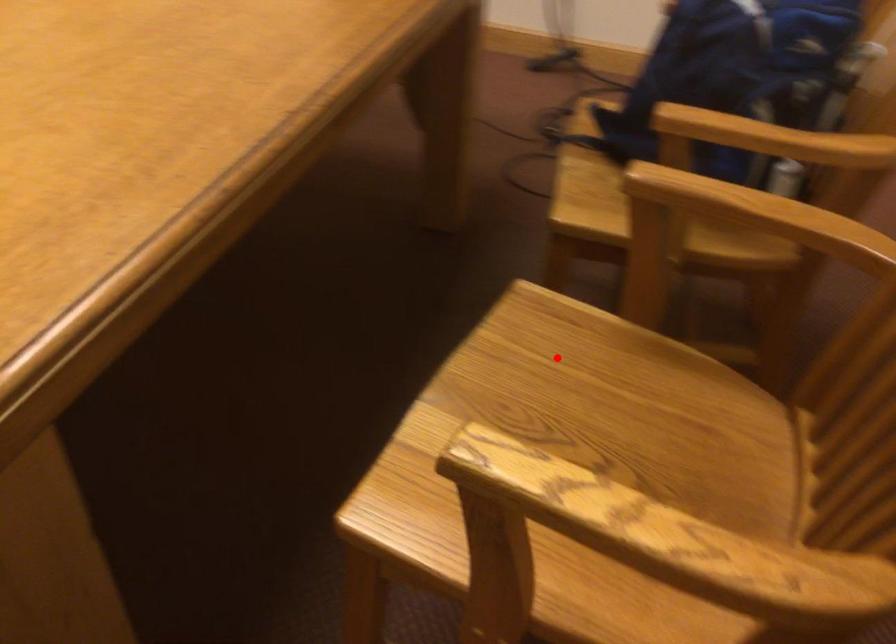
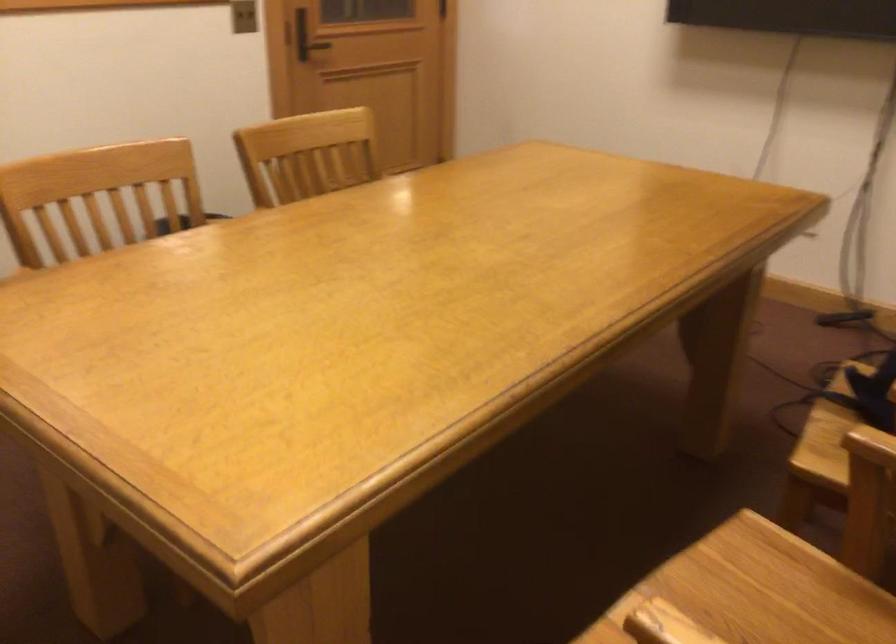
Question: I am providing you with two images of the same scene from different viewpoints. Given a red point in image1, look at the same physical point in image2. Is it:

Choices:
 (A) Closer to the viewpoint
 (B) Farther from the viewpoint

Answer: (B)